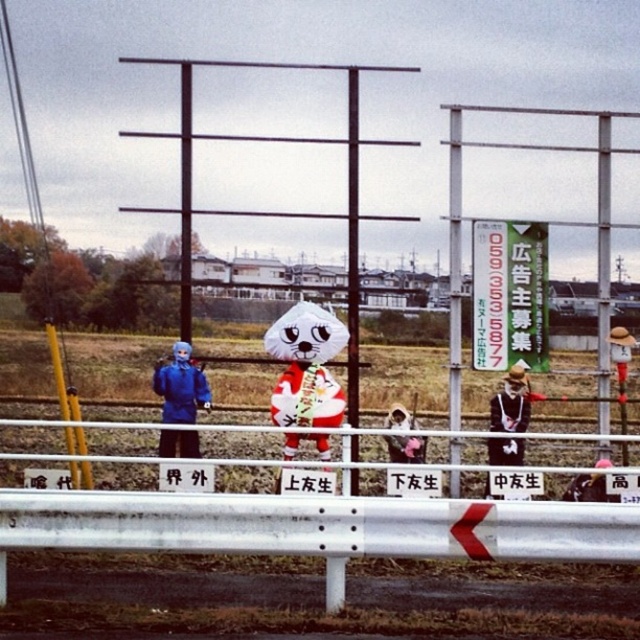
Can you confirm if smooth asphalt road at lower center is positioned to the left of white plush toy at center?

Incorrect, smooth asphalt road at lower center is not on the left side of white plush toy at center.

Is point (116, 612) behind point (273, 340)?

No, (116, 612) is closer to viewer.

You are a GUI agent. You are given a task and a screenshot of the screen. Output one action in this format:
    pyautogui.click(x=<x>, y=<y>)
    Task: Click on the smooth asphalt road at lower center
    The height and width of the screenshot is (640, 640).
    Given the screenshot: What is the action you would take?
    pyautogui.click(x=316, y=596)

Is white plush toy at center taller than black leather jacket at center?

Correct, white plush toy at center is much taller as black leather jacket at center.

Between white plush toy at center and black leather jacket at center, which one is positioned lower?

Positioned lower is black leather jacket at center.

Describe the element at coordinates (307, 365) in the screenshot. The height and width of the screenshot is (640, 640). I see `white plush toy at center` at that location.

The height and width of the screenshot is (640, 640). Identify the location of white plush toy at center. (307, 365).

Who is more distant from viewer, (456, 300) or (172, 406)?

Point (456, 300)

Which is in front, point (456, 237) or point (161, 387)?

Point (161, 387) is more forward.

Where is `white metal pole at center`? Image resolution: width=640 pixels, height=640 pixels. white metal pole at center is located at coordinates (454, 264).

The image size is (640, 640). In order to click on white metal pole at center in this screenshot , I will do `click(454, 264)`.